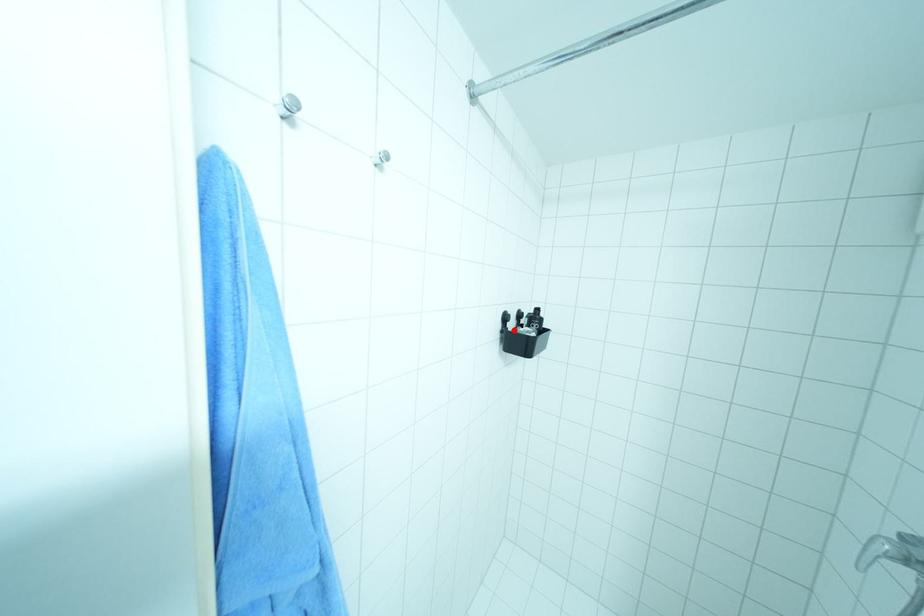
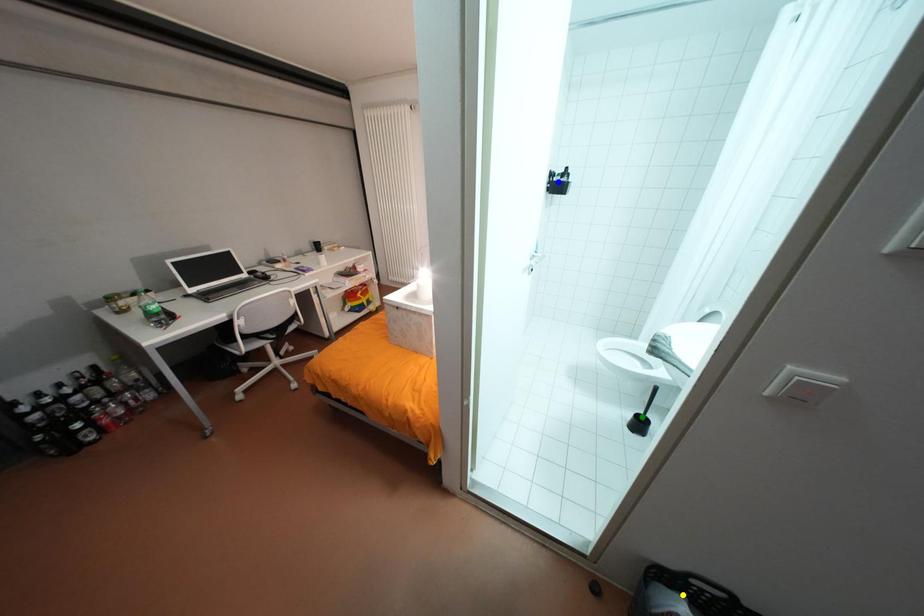
Question: I am providing you with two images of the same scene from different viewpoints. A red point is marked on the first image. You are given multiple points on the second image. In image 2, which mark is for the same physical point as the one in image 1?

Choices:
 (A) blue point
 (B) green point
 (C) yellow point

Answer: (A)